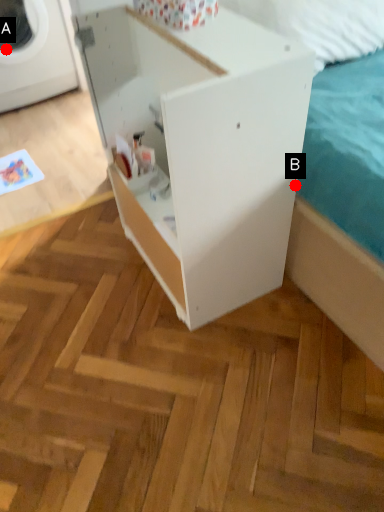
Question: Two points are circled on the image, labeled by A and B beside each circle. Which point is closer to the camera taking this photo?

Choices:
 (A) A is closer
 (B) B is closer

Answer: (B)